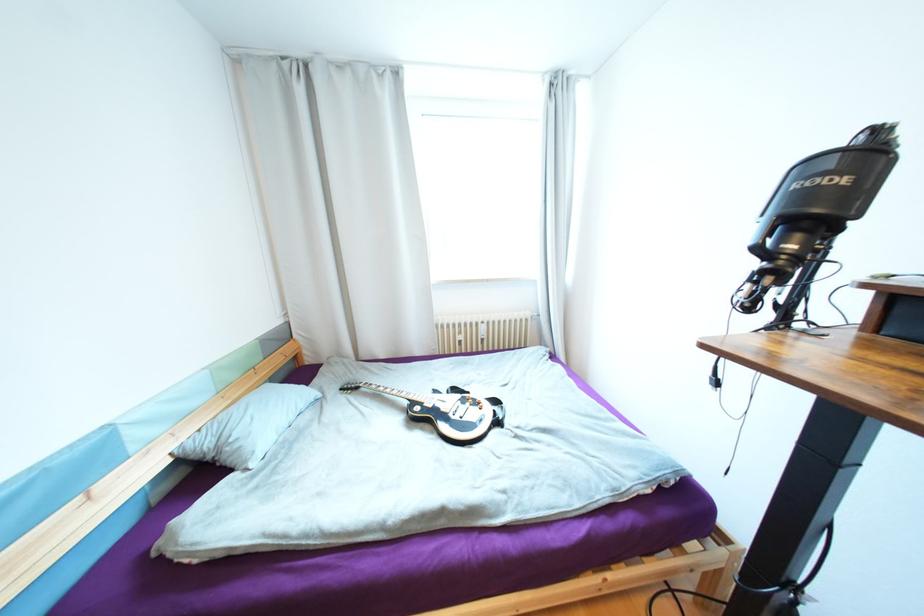
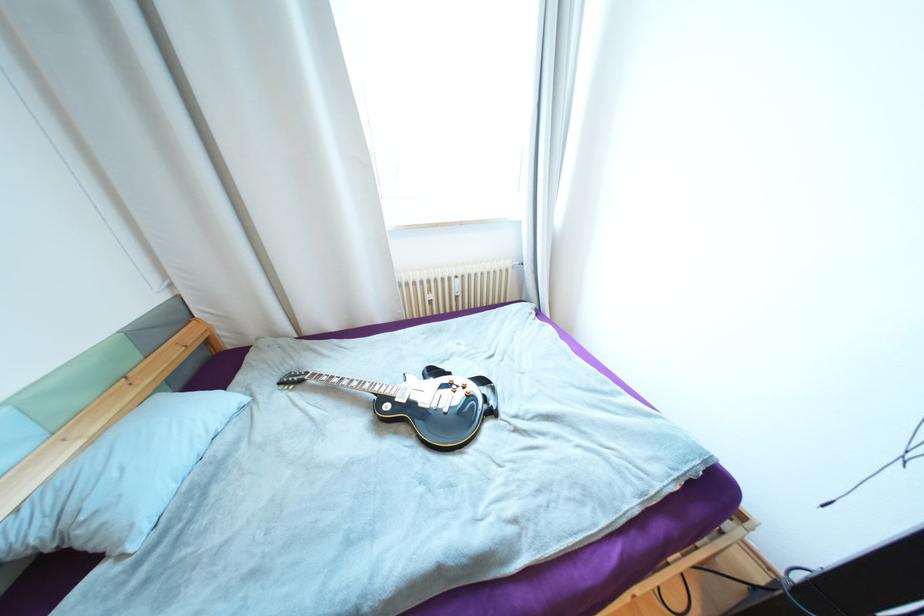
Question: The first image is from the beginning of the video and the second image is from the end. How did the camera likely rotate when shooting the video?

Choices:
 (A) Left
 (B) Right
 (C) Up
 (D) Down

Answer: (D)